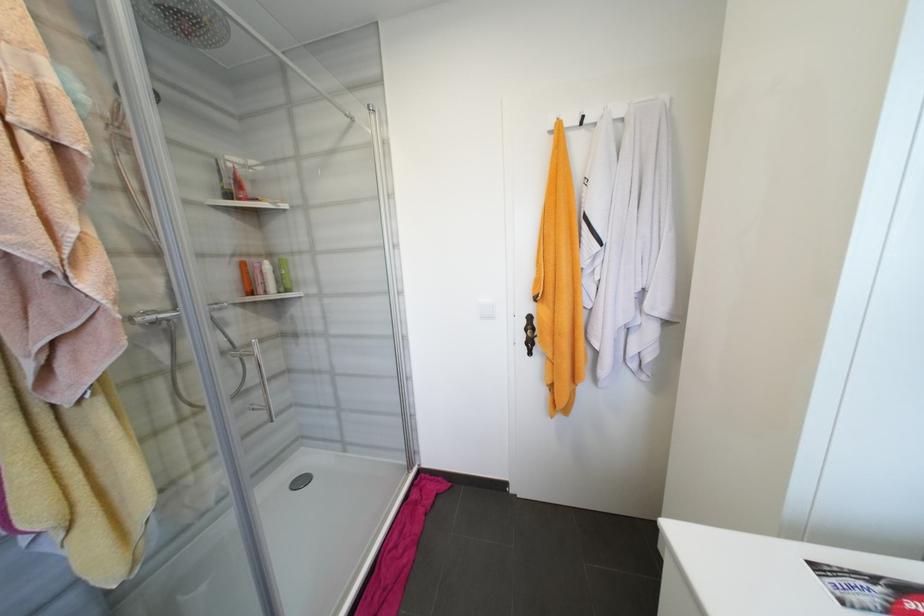
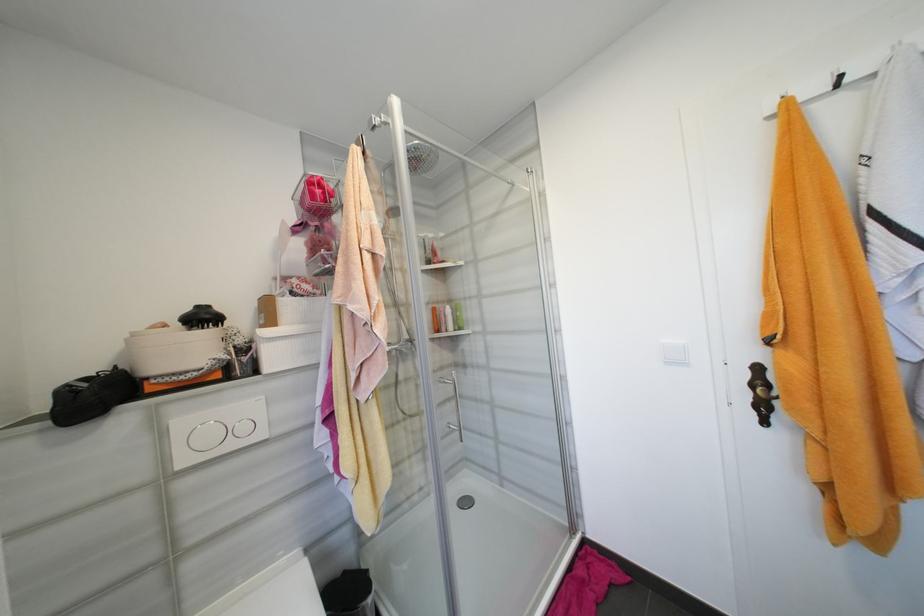
Locate, in the second image, the point that corresponds to point 278,265 in the first image.

(457, 309)